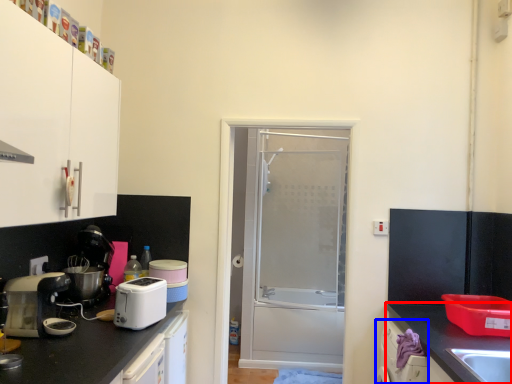
Question: Which object appears farthest to the camera in this image, countertop (highlighted by a red box) or dish washer (highlighted by a blue box)?

Choices:
 (A) countertop
 (B) dish washer

Answer: (B)